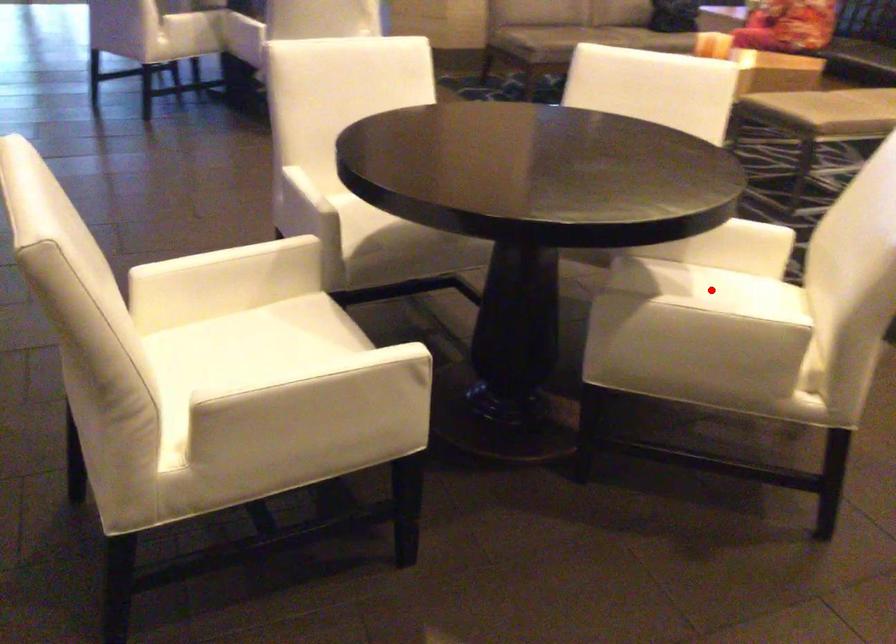
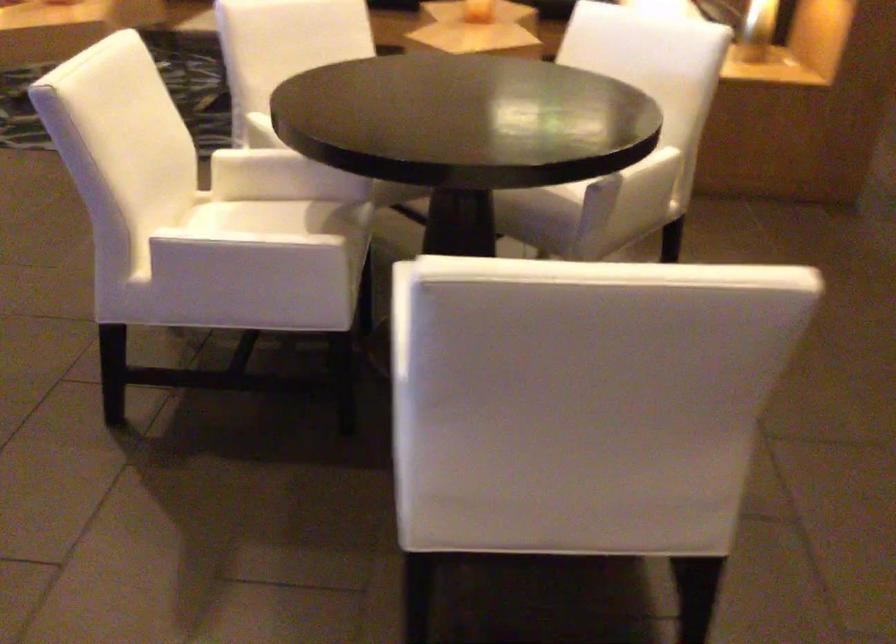
Question: I am providing you with two images of the same scene from different viewpoints. A red point is marked on the first image. Can you still see the location of the red point in image 2?

Choices:
 (A) Yes
 (B) No

Answer: (B)